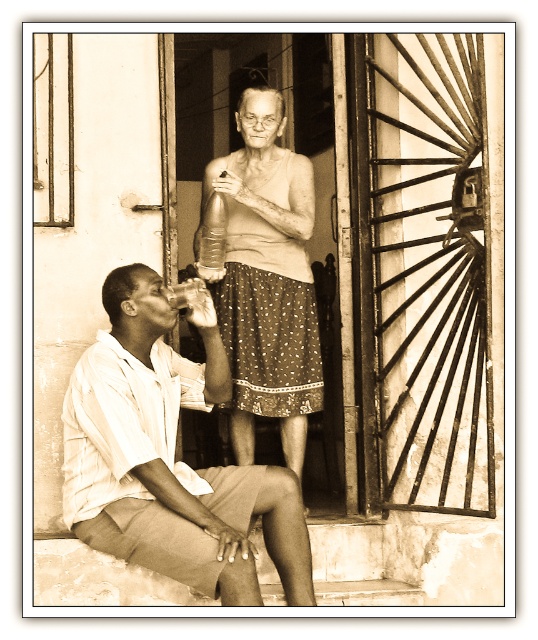
Question: Among these objects, which one is farthest from the camera?

Choices:
 (A) translucent glass drink at center
 (B) white cotton shirt at lower left
 (C) metallic silver bottle at upper center
 (D) matte white blouse at center

Answer: (C)

Question: Is matte white blouse at center bigger than metallic silver bottle at upper center?

Choices:
 (A) yes
 (B) no

Answer: (A)

Question: Which object appears farthest from the camera in this image?

Choices:
 (A) matte white blouse at center
 (B) metallic silver bottle at upper center
 (C) white cotton shirt at lower left
 (D) translucent glass drink at center

Answer: (B)

Question: Which of these objects is positioned closest to the translucent glass drink at center?

Choices:
 (A) matte white blouse at center
 (B) metallic silver bottle at upper center
 (C) white cotton shirt at lower left

Answer: (B)

Question: Can you confirm if white cotton shirt at lower left is positioned to the left of matte white blouse at center?

Choices:
 (A) no
 (B) yes

Answer: (B)

Question: In this image, where is white cotton shirt at lower left located relative to metallic silver bottle at upper center?

Choices:
 (A) right
 (B) left

Answer: (B)